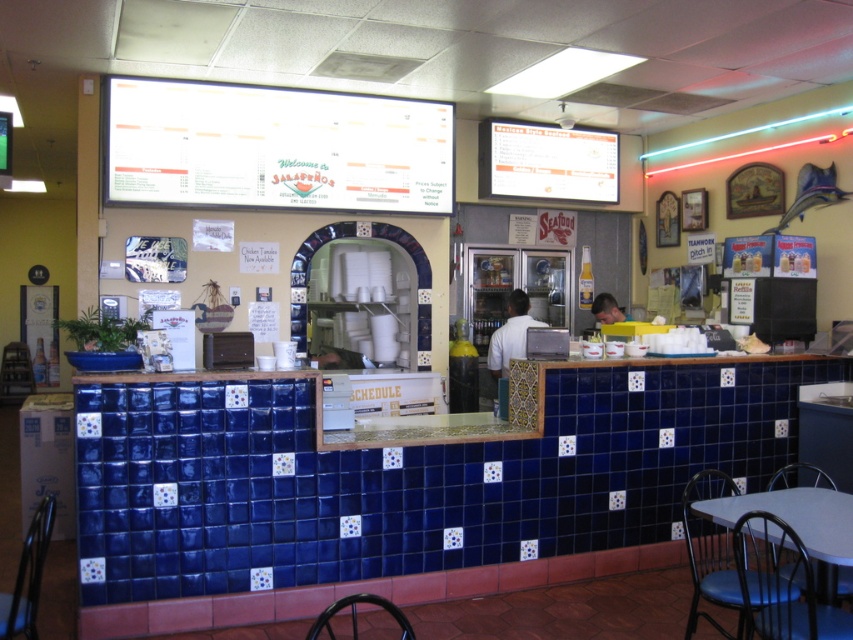
Question: Which of the following is the farthest from the observer?

Choices:
 (A) (781, 484)
 (B) (20, 588)
 (C) (799, 531)

Answer: (A)

Question: Is metallic gray table at lower right to the left of metallic blue chair at lower right from the viewer's perspective?

Choices:
 (A) no
 (B) yes

Answer: (B)

Question: Which of the following is the closest to the observer?

Choices:
 (A) metallic blue chair at lower right
 (B) black plastic chair at lower center
 (C) metallic black chair at lower left

Answer: (C)

Question: Is blue tile counter at center closer to the viewer compared to metallic gray table at lower right?

Choices:
 (A) yes
 (B) no

Answer: (B)

Question: Is blue tile counter at center further to camera compared to metallic gray table at lower right?

Choices:
 (A) no
 (B) yes

Answer: (B)

Question: Which point is farther from the camera taking this photo?

Choices:
 (A) (44, 513)
 (B) (329, 634)

Answer: (B)